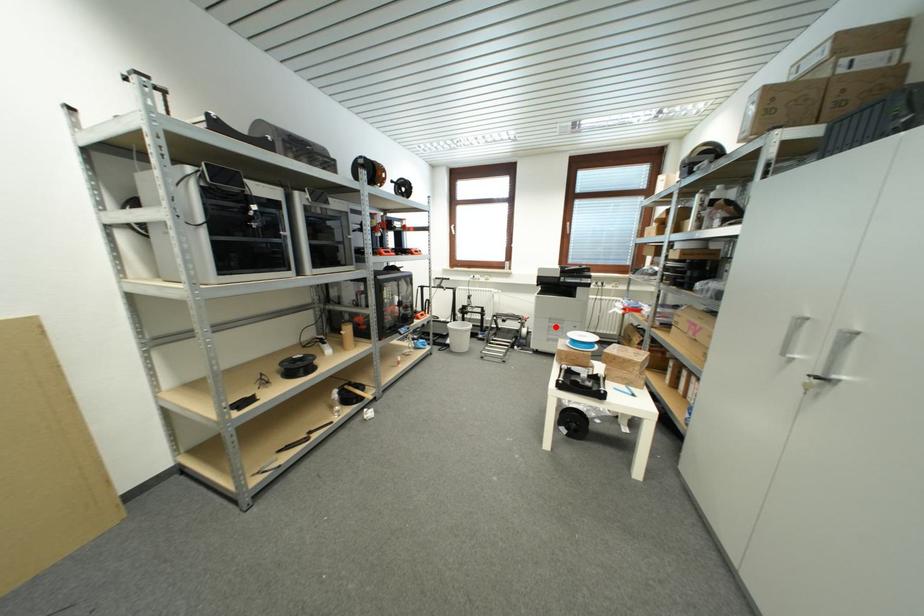
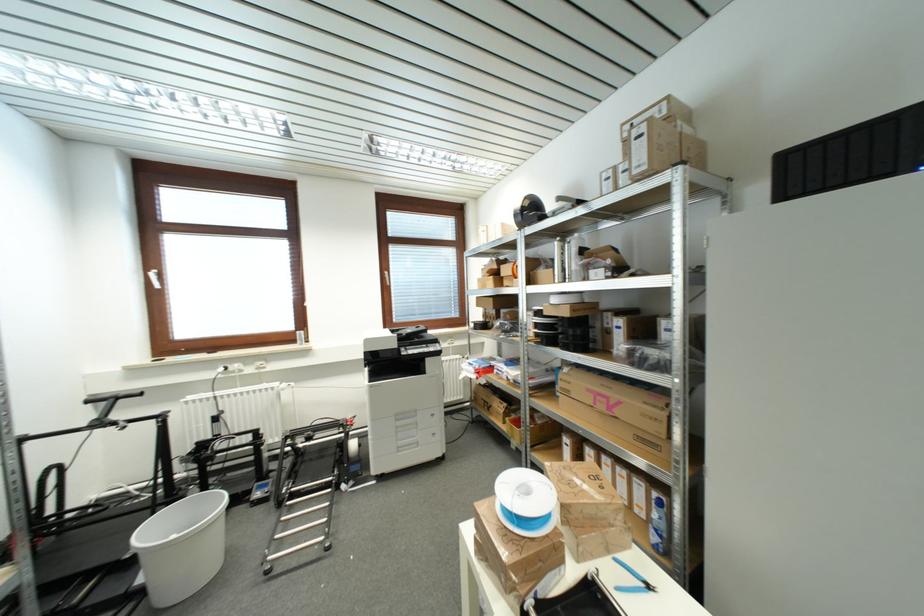
Question: I am providing you with two images of the same scene from different viewpoints. Image1 has a red point marked. In image2, the corresponding 3D location appears at what relative position? Reply with the corresponding letter.

Choices:
 (A) Closer
 (B) Farther

Answer: (B)